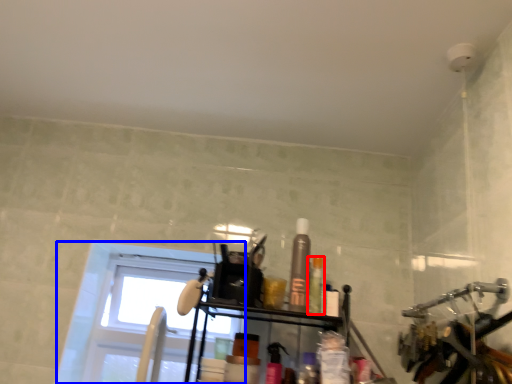
Question: Among these objects, which one is nearest to the camera, toiletry (highlighted by a red box) or window (highlighted by a blue box)?

Choices:
 (A) toiletry
 (B) window

Answer: (A)